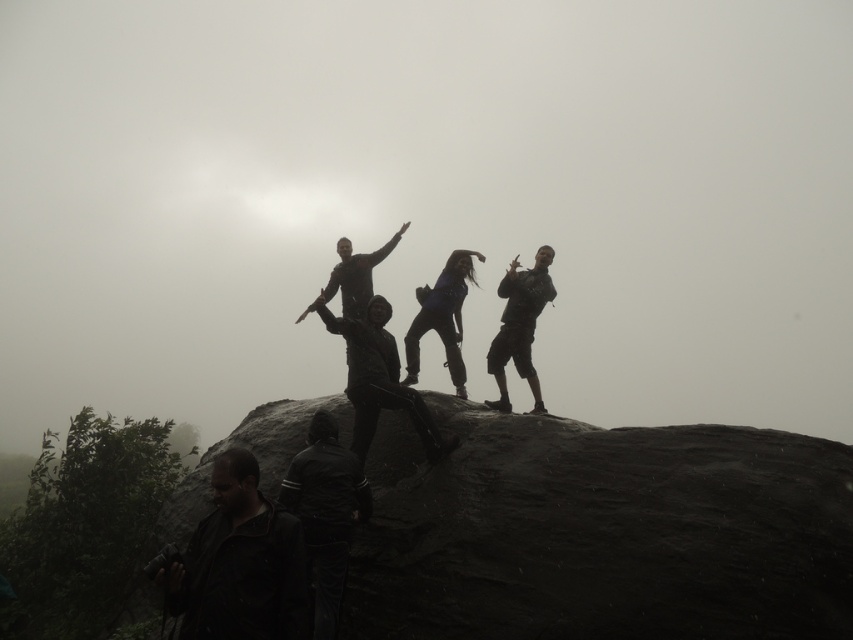
Question: Can you confirm if dark gray jacket at lower left is bigger than dark blue fabric pants at center?

Choices:
 (A) no
 (B) yes

Answer: (A)

Question: Is dark matte jacket at center below dark gray pants at upper right?

Choices:
 (A) no
 (B) yes

Answer: (B)

Question: Which point is farther to the camera?

Choices:
 (A) dark blue fabric pants at center
 (B) dark gray pants at upper right

Answer: (A)

Question: Can you confirm if dark gray pants at upper right is positioned below dark blue fabric pants at center?

Choices:
 (A) no
 (B) yes

Answer: (A)

Question: Which point appears closest to the camera in this image?

Choices:
 (A) (546, 252)
 (B) (341, 483)
 (C) (403, 381)
 (D) (287, 531)

Answer: (D)

Question: Which object is the closest to the dark blue fabric pants at center?

Choices:
 (A) dark gray jacket at lower left
 (B) dark matte jacket at center
 (C) dark gray pants at upper right
 (D) dark gray leather jacket at lower left

Answer: (C)